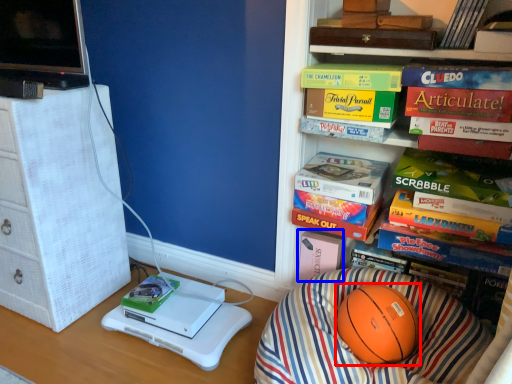
Question: Which object is further to the camera taking this photo, ball (highlighted by a red box) or paperback book (highlighted by a blue box)?

Choices:
 (A) ball
 (B) paperback book

Answer: (B)